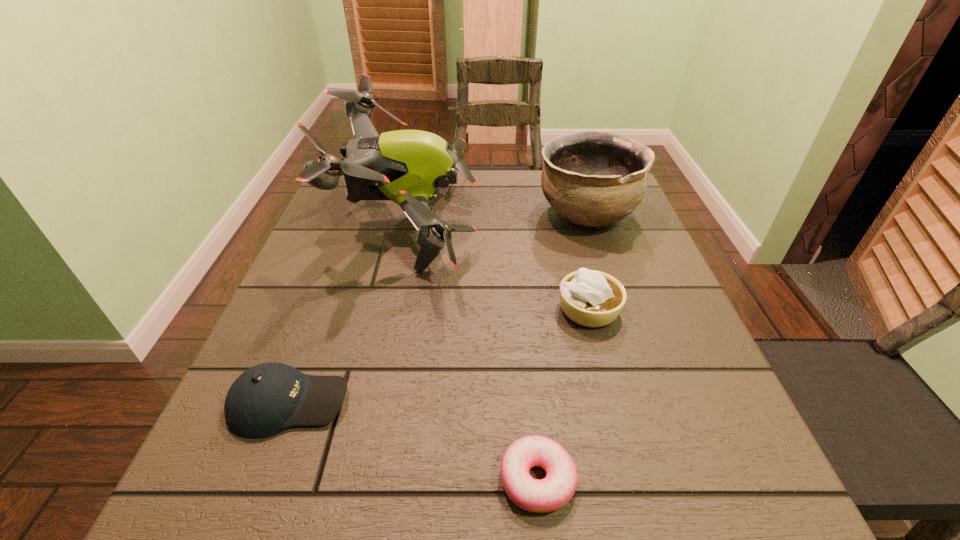
Locate an element on the screen. The width and height of the screenshot is (960, 540). drone is located at coordinates (406, 166).

Image resolution: width=960 pixels, height=540 pixels. What are the coordinates of `pottery` in the screenshot? It's located at (591, 178).

The width and height of the screenshot is (960, 540). I want to click on the third tallest object, so point(590,298).

At what (x,y) coordinates should I click in order to perform the action: click on the fourth tallest object. Please return your answer as a coordinate pair (x, y). The height and width of the screenshot is (540, 960). Looking at the image, I should click on (x=264, y=400).

Identify the location of the second nearest object. The width and height of the screenshot is (960, 540). (264, 400).

Find the location of `the shortest object`. the shortest object is located at coordinates (551, 493).

Find the location of a particular element. This screenshot has height=540, width=960. doughnut is located at coordinates (551, 493).

Where is `vacant area situated on the front-facing side of the drone`? The image size is (960, 540). vacant area situated on the front-facing side of the drone is located at coordinates (593, 225).

Where is `free space located on the front of the pottery`? The image size is (960, 540). free space located on the front of the pottery is located at coordinates (606, 272).

At what (x,y) coordinates should I click in order to perform the action: click on vacant region located 0.300m on the front of the whipped cream. Please return your answer as a coordinate pair (x, y). This screenshot has height=540, width=960. Looking at the image, I should click on (638, 498).